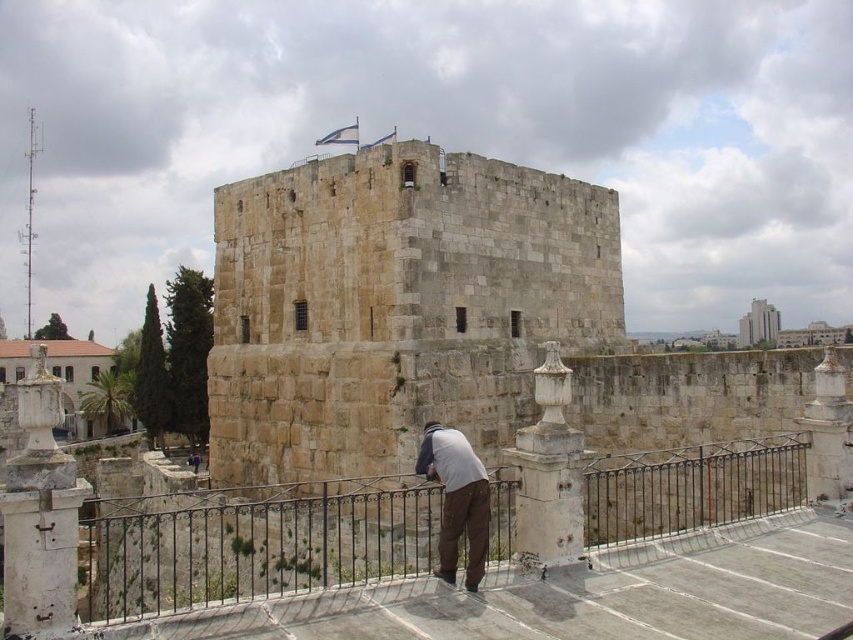
Between stone tower at center and black wrought iron railing at center, which one is positioned lower?

black wrought iron railing at center is lower down.

Can you confirm if stone tower at center is taller than black wrought iron railing at center?

Yes.

The height and width of the screenshot is (640, 853). Identify the location of stone tower at center. (442, 321).

Based on the photo, can you confirm if stone tower at center is positioned above light gray fabric shirt at lower center?

Yes.

How distant is stone tower at center from light gray fabric shirt at lower center?

stone tower at center is 13.21 meters from light gray fabric shirt at lower center.

Is point (341, 448) more distant than point (432, 460)?

Yes, it is behind point (432, 460).

Locate an element on the screen. This screenshot has height=640, width=853. stone tower at center is located at coordinates (442, 321).

Is black wrought iron railing at center wider than light gray fabric shirt at lower center?

Indeed, black wrought iron railing at center has a greater width compared to light gray fabric shirt at lower center.

Between black wrought iron railing at center and light gray fabric shirt at lower center, which one is positioned higher?

light gray fabric shirt at lower center is above.

Where is `black wrought iron railing at center`? black wrought iron railing at center is located at coordinates (252, 545).

Where is `black wrought iron railing at center`? The image size is (853, 640). black wrought iron railing at center is located at coordinates (252, 545).